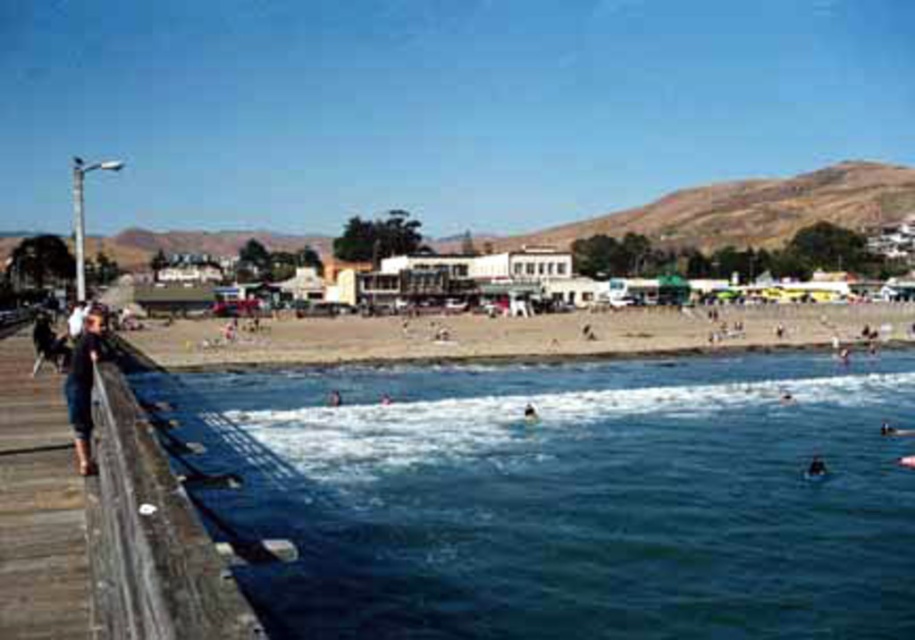
You are standing on the wooden pier and want to jump into the water. The safety guidelines state that you must be at least 250 feet away from the blue water at lower center to ensure a safe entry. Are you within the safe distance according to the guidelines?

The blue water at lower center and viewer are 246.10 feet apart. Since 246.10 feet is less than the required 250 feet, you are not within the safe distance according to the guidelines.

In the scene shown: You are standing on the wooden pier and want to take a photo of the blue water at lower center. Based on its coordinates, where should you aim your camera to capture it?

The blue water at lower center is located at point coordinates 0.777 on the x axis and 0.621 on the y axis, so you should aim your camera towards those coordinates to capture it.

You are standing on the wooden dock at lower left and want to walk to the dark blue skin at lower right. Which direction should you move to reach it?

The wooden dock at lower left is positioned on the left side of dark blue skin at lower right, so you should move to the right to reach it.